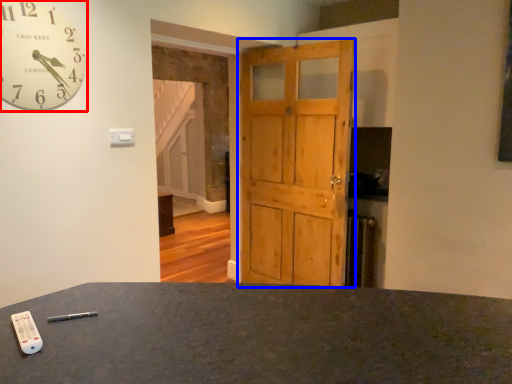
Question: Among these objects, which one is farthest to the camera, wall clock (highlighted by a red box) or barn door (highlighted by a blue box)?

Choices:
 (A) wall clock
 (B) barn door

Answer: (B)